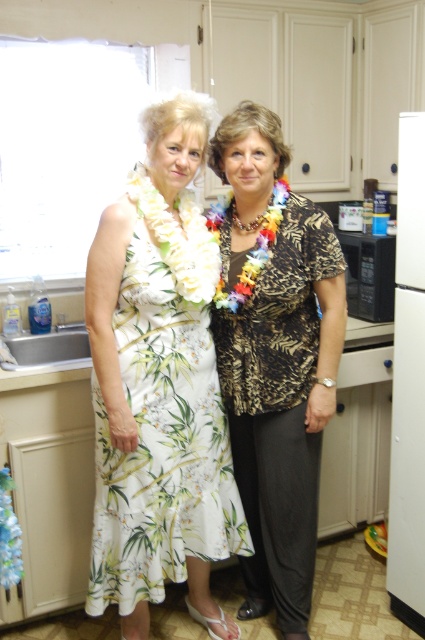
Is printed fabric blouse at center shorter than white floral dress at center?

No, printed fabric blouse at center is not shorter than white floral dress at center.

Is printed fabric blouse at center taller than white floral dress at center?

Yes, printed fabric blouse at center is taller than white floral dress at center.

Which is in front, point (231, 401) or point (104, 596)?

Positioned in front is point (104, 596).

Where is `printed fabric blouse at center`? printed fabric blouse at center is located at coordinates 283,404.